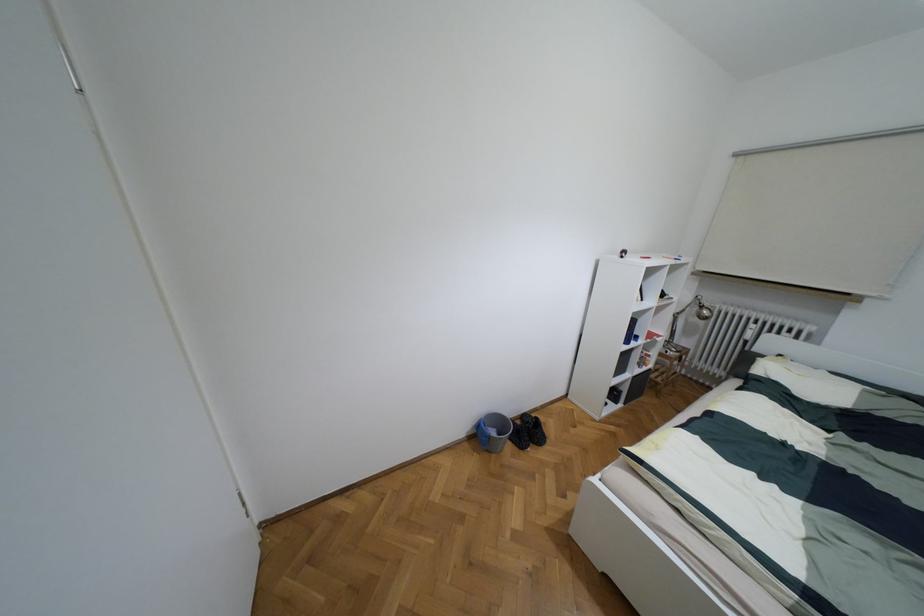
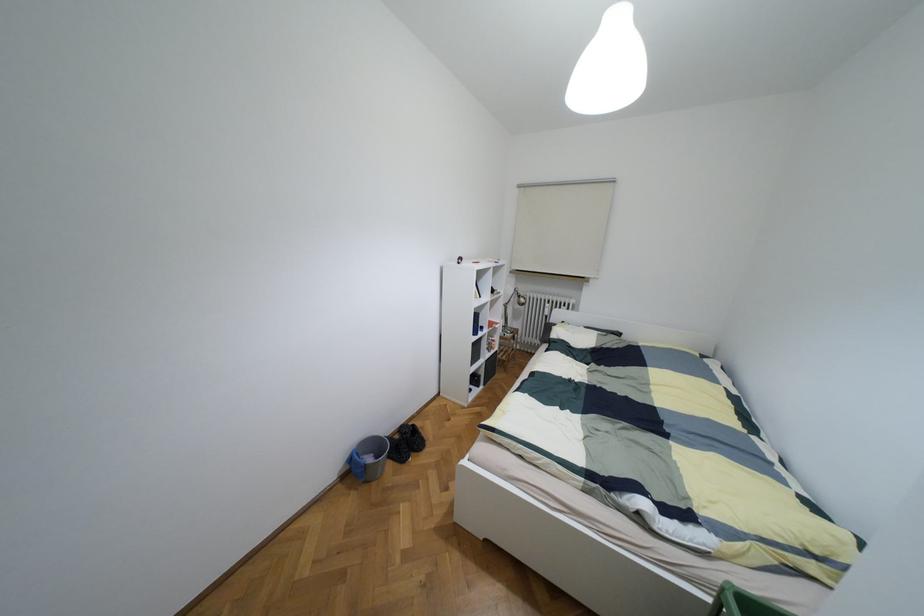
Where in the second image is the point corresponding to [492,432] from the first image?

(369, 459)